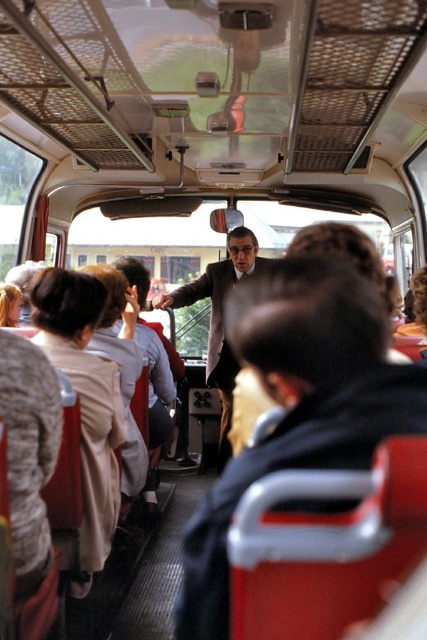
You are a passenger on the bus and you notice the matte black jacket at center and the dark gray suit at center. Which one is positioned higher in the image?

The matte black jacket at center is above the dark gray suit at center, so it is positioned higher.